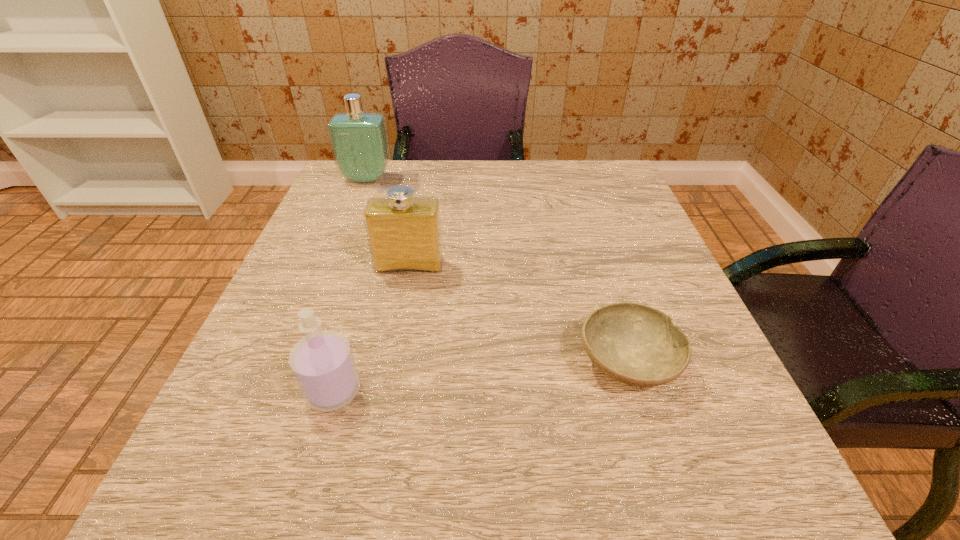
At what (x,y) coordinates should I click in order to perform the action: click on object present at the far edge. Please return your answer as a coordinate pair (x, y). The image size is (960, 540). Looking at the image, I should click on (359, 141).

The image size is (960, 540). In order to click on object at the right edge in this screenshot , I will do `click(636, 344)`.

Find the location of a particular element. This screenshot has width=960, height=540. object that is at the far left corner is located at coordinates (359, 141).

Image resolution: width=960 pixels, height=540 pixels. Find the location of `free region at the far edge of the desktop`. free region at the far edge of the desktop is located at coordinates (488, 185).

You are a GUI agent. You are given a task and a screenshot of the screen. Output one action in this format:
    pyautogui.click(x=<x>, y=<y>)
    Task: Click on the vacant space at the near edge of the desktop
    This screenshot has height=540, width=960.
    Given the screenshot: What is the action you would take?
    pyautogui.click(x=343, y=454)

This screenshot has width=960, height=540. In the image, there is a desktop. In order to click on free region at the left edge in this screenshot , I will do `click(347, 252)`.

The width and height of the screenshot is (960, 540). I want to click on vacant space at the right edge of the desktop, so click(x=690, y=396).

Where is `free region at the near left corner of the desktop`? free region at the near left corner of the desktop is located at coordinates (221, 502).

In the image, there is a desktop. Identify the location of free space at the far right corner. This screenshot has width=960, height=540. (591, 207).

At what (x,y) coordinates should I click in order to perform the action: click on vacant area that lies between the third nearest object and the shortest object. Please return your answer as a coordinate pair (x, y). Looking at the image, I should click on (518, 314).